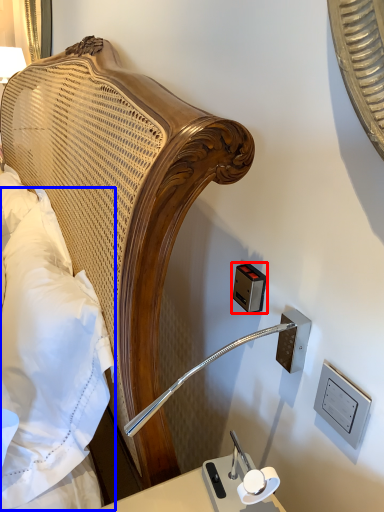
Question: Which object appears closest to the camera in this image, electric outlet (highlighted by a red box) or pillow (highlighted by a blue box)?

Choices:
 (A) electric outlet
 (B) pillow

Answer: (B)